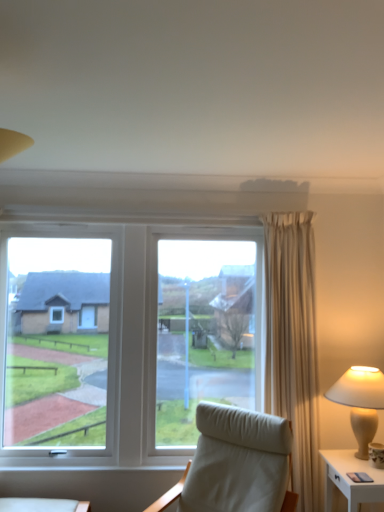
Question: Would you say white fabric chair at center is part of white ceramic lamp at right's contents?

Choices:
 (A) no
 (B) yes

Answer: (A)

Question: From the image's perspective, is white ceramic lamp at right beneath white fabric chair at center?

Choices:
 (A) no
 (B) yes

Answer: (A)

Question: Is white ceramic lamp at right with white fabric chair at center?

Choices:
 (A) yes
 (B) no

Answer: (B)

Question: Considering the relative sizes of white ceramic lamp at right and white fabric chair at center in the image provided, is white ceramic lamp at right taller than white fabric chair at center?

Choices:
 (A) no
 (B) yes

Answer: (A)

Question: Is white ceramic lamp at right bigger than white fabric chair at center?

Choices:
 (A) no
 (B) yes

Answer: (A)

Question: Is white fabric chair at center at the back of white ceramic lamp at right?

Choices:
 (A) yes
 (B) no

Answer: (B)

Question: Is the position of white glossy nightstand at lower right less distant than that of white fabric chair at center?

Choices:
 (A) no
 (B) yes

Answer: (A)

Question: From a real-world perspective, is white glossy nightstand at lower right over white fabric chair at center?

Choices:
 (A) no
 (B) yes

Answer: (A)

Question: Is white glossy nightstand at lower right positioned far away from white fabric chair at center?

Choices:
 (A) yes
 (B) no

Answer: (B)

Question: From the image's perspective, is white glossy nightstand at lower right below white fabric chair at center?

Choices:
 (A) no
 (B) yes

Answer: (B)

Question: Is white glossy nightstand at lower right bigger than white fabric chair at center?

Choices:
 (A) yes
 (B) no

Answer: (B)

Question: Is white fabric chair at center inside white glossy nightstand at lower right?

Choices:
 (A) no
 (B) yes

Answer: (A)

Question: From a real-world perspective, is white ceramic lamp at right located higher than white glossy nightstand at lower right?

Choices:
 (A) yes
 (B) no

Answer: (A)